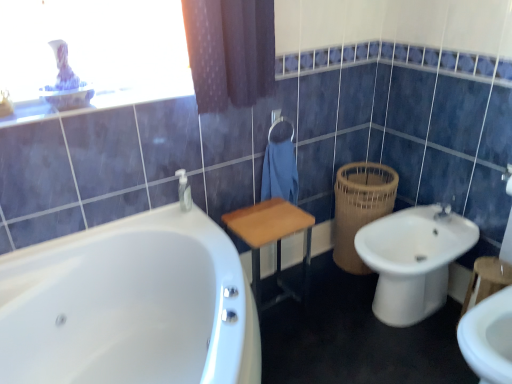
Where is `vacant space that is to the left of woven brown basket at right`? This screenshot has width=512, height=384. vacant space that is to the left of woven brown basket at right is located at coordinates (319, 273).